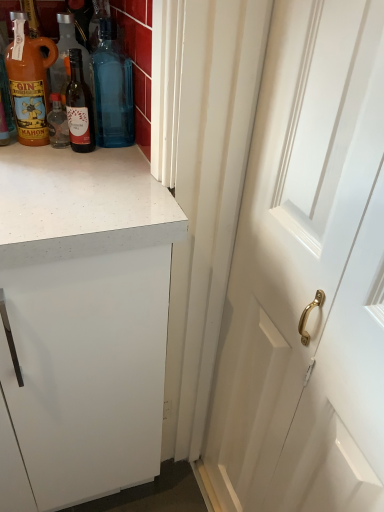
Question: Considering the positions of point (109, 113) and point (324, 467), is point (109, 113) closer or farther from the camera than point (324, 467)?

Choices:
 (A) farther
 (B) closer

Answer: (A)

Question: Is blue glass bottle at upper center, which ranks as the first bottle in right-to-left order, inside the boundaries of white wooden door at right, or outside?

Choices:
 (A) inside
 (B) outside

Answer: (B)

Question: Considering the real-world distances, which object is farthest from the white wooden door at right?

Choices:
 (A) matte glass bottle at upper center, marked as the second bottle in a right-to-left arrangement
 (B) blue glass bottle at upper center, which is counted as the 3th bottle, starting from the left
 (C) matte orange bottle at left, the 1th bottle when ordered from left to right

Answer: (C)

Question: Considering the real-world distances, which object is farthest from the matte glass bottle at upper center, which is the 2th bottle in left-to-right order?

Choices:
 (A) blue glass bottle at upper center, which ranks as the first bottle in right-to-left order
 (B) matte orange bottle at left, the 1th bottle when ordered from left to right
 (C) white wooden door at right

Answer: (C)